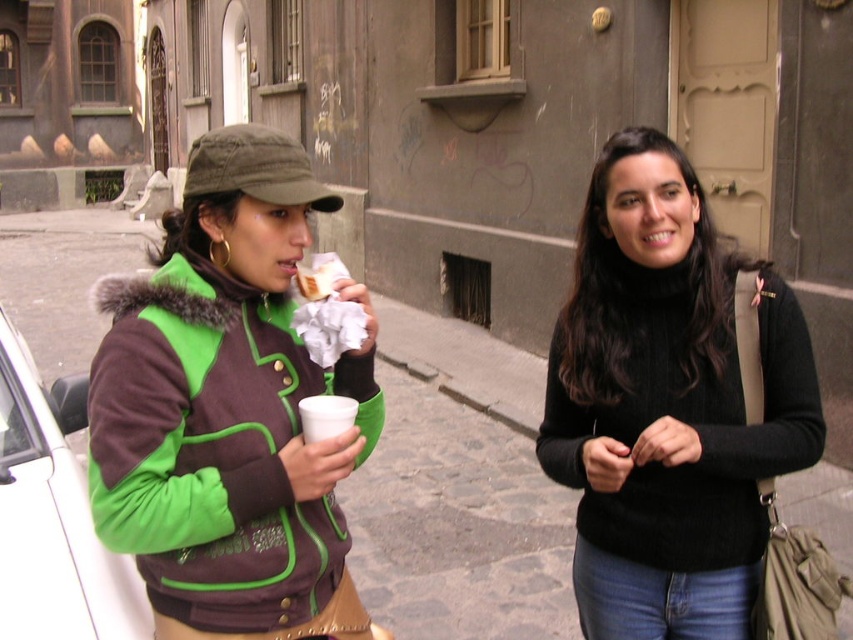
Consider the image. You are a photographer trying to capture both the green fuzzy jacket at left and the white matte car at left in the same frame. Based on their sizes, which object should you focus on first to ensure both fit in the photo?

The green fuzzy jacket at left is smaller than the white matte car at left, so you should focus on the white matte car at left first to ensure both fit in the photo.

You are a pedestrian trying to cross the street safely. You see the green fuzzy jacket at left and the white matte car at left. Which one is closer to you?

The green fuzzy jacket at left is closer to you because it is in front of the white matte car at left.